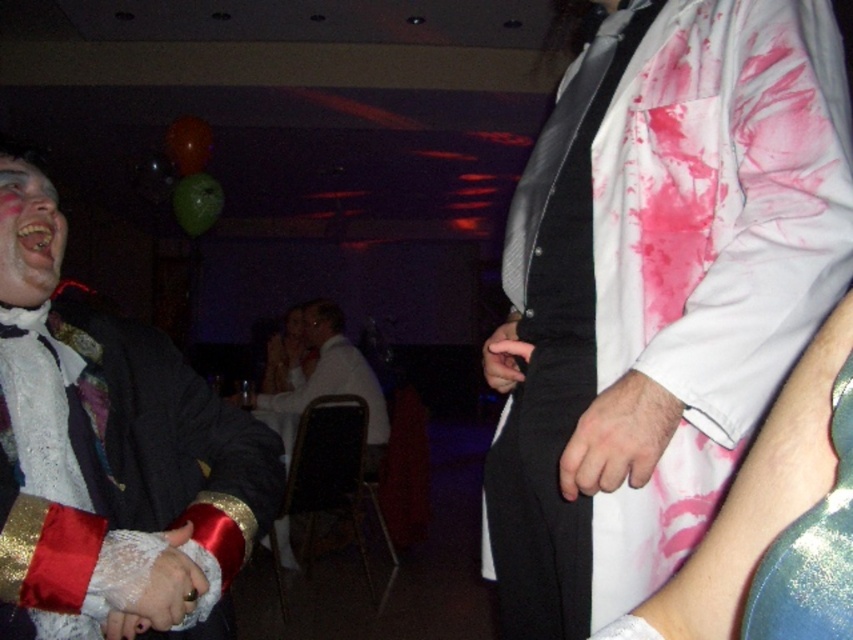
Can you confirm if white glossy shirt at center is wider than black leather glove at center?

Indeed, white glossy shirt at center has a greater width compared to black leather glove at center.

Which of these two, white glossy shirt at center or black leather glove at center, stands taller?

With more height is white glossy shirt at center.

Measure the distance between point (677, 472) and camera.

Point (677, 472) is 86.19 centimeters away from camera.

Image resolution: width=853 pixels, height=640 pixels. Identify the location of white glossy shirt at center. pyautogui.click(x=660, y=289).

Can you confirm if white lace glove at left is positioned to the left of smooth white face at center?

Incorrect, white lace glove at left is not on the left side of smooth white face at center.

Which of these two, white lace glove at left or smooth white face at center, stands taller?

white lace glove at left

Is point (90, 608) less distant than point (303, 333)?

Yes.

I want to click on white lace glove at left, so click(109, 456).

How distant is white satin shirt at center from black leather glove at center?

A distance of 7.59 feet exists between white satin shirt at center and black leather glove at center.

Find the location of `white satin shirt at center`. white satin shirt at center is located at coordinates (322, 381).

Describe the element at coordinates (322, 381) in the screenshot. I see `white satin shirt at center` at that location.

You are a GUI agent. You are given a task and a screenshot of the screen. Output one action in this format:
    pyautogui.click(x=<x>, y=<y>)
    Task: Click on the white satin shirt at center
    The width and height of the screenshot is (853, 640).
    Given the screenshot: What is the action you would take?
    pyautogui.click(x=322, y=381)